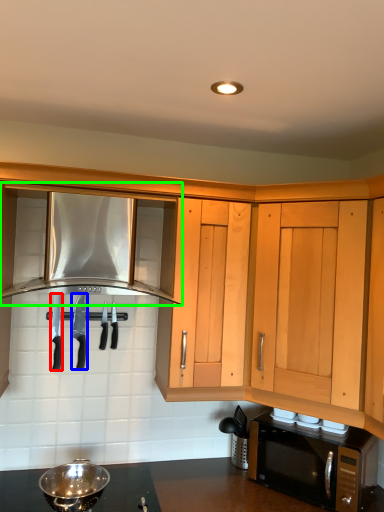
Question: Which object is the farthest from knife (highlighted by a red box)? Choose among these: knife (highlighted by a blue box) or cabinetry (highlighted by a green box).

Choices:
 (A) knife
 (B) cabinetry

Answer: (B)